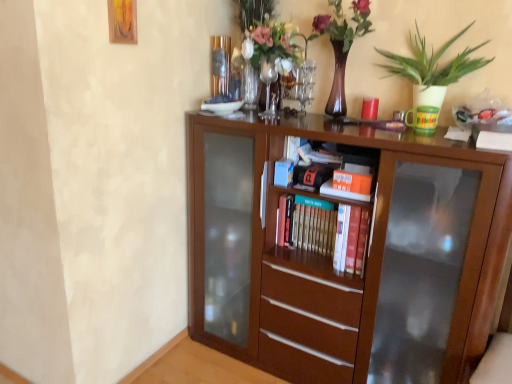
Question: Can you confirm if orange matte book at center, placed as the first book when sorted from front to back, is positioned to the right of brown wooden bookcase at center?

Choices:
 (A) no
 (B) yes

Answer: (B)

Question: Is orange matte book at center, which ranks as the 1th book in top-to-bottom order, looking in the opposite direction of brown wooden bookcase at center?

Choices:
 (A) yes
 (B) no

Answer: (A)

Question: Does orange matte book at center, which ranks as the 1th book in top-to-bottom order, lie behind brown wooden bookcase at center?

Choices:
 (A) no
 (B) yes

Answer: (B)

Question: From a real-world perspective, is orange matte book at center, the 2th book positioned from the back, on brown wooden bookcase at center?

Choices:
 (A) no
 (B) yes

Answer: (B)

Question: From the image's perspective, does orange matte book at center, the 2th book positioned from the back, appear lower than brown wooden bookcase at center?

Choices:
 (A) yes
 (B) no

Answer: (B)

Question: Could you tell me if orange matte book at center, which is the second book from bottom to top, is facing brown wooden bookcase at center?

Choices:
 (A) no
 (B) yes

Answer: (B)

Question: From the image's perspective, is matte brown vase with flowers at upper center under wooden picture frame at upper left?

Choices:
 (A) no
 (B) yes

Answer: (B)

Question: Does matte brown vase with flowers at upper center have a smaller size compared to wooden picture frame at upper left?

Choices:
 (A) yes
 (B) no

Answer: (B)

Question: Could wooden picture frame at upper left be considered to be inside matte brown vase with flowers at upper center?

Choices:
 (A) no
 (B) yes

Answer: (A)

Question: Would you consider matte brown vase with flowers at upper center to be distant from wooden picture frame at upper left?

Choices:
 (A) yes
 (B) no

Answer: (B)

Question: Is matte brown vase with flowers at upper center to the right of wooden picture frame at upper left from the viewer's perspective?

Choices:
 (A) yes
 (B) no

Answer: (A)

Question: Does matte brown vase with flowers at upper center have a lesser height compared to wooden picture frame at upper left?

Choices:
 (A) no
 (B) yes

Answer: (A)

Question: Is matte brown vase with flowers at upper center shorter than orange matte book at center, which ranks as the 1th book in top-to-bottom order?

Choices:
 (A) yes
 (B) no

Answer: (B)